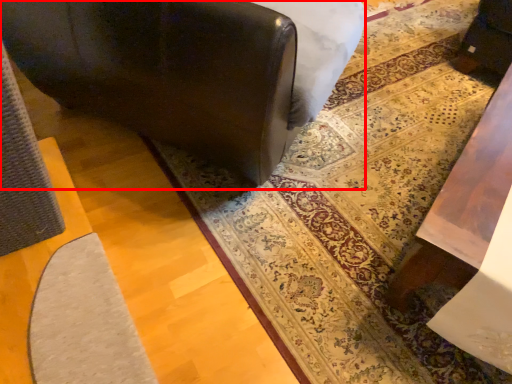
Question: In this image, where is furniture (annotated by the red box) located relative to mat?

Choices:
 (A) right
 (B) left

Answer: (B)